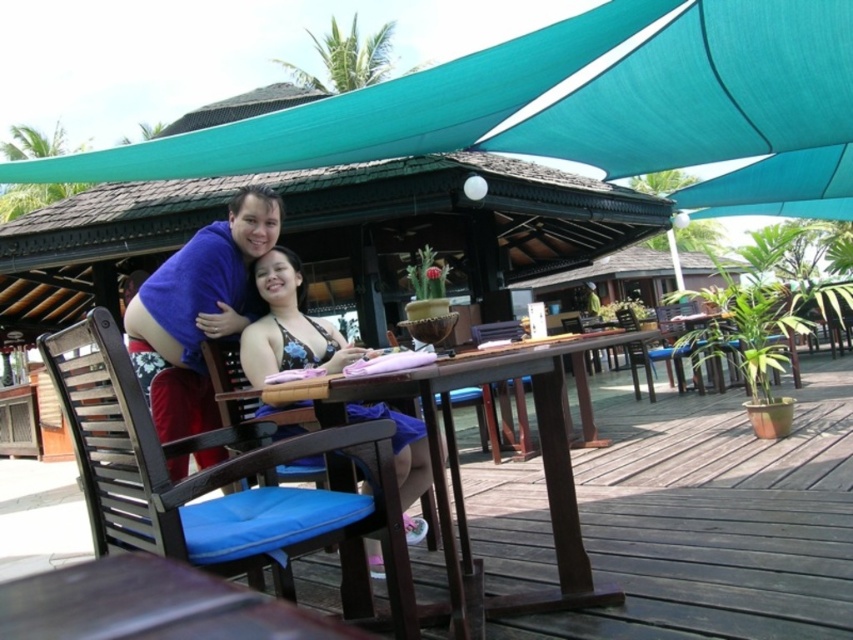
Question: Where is teal fabric canopy at upper center located in relation to blue padded chair at center in the image?

Choices:
 (A) left
 (B) right

Answer: (B)

Question: Where is teal fabric canopy at upper center located in relation to black floral bikini at center in the image?

Choices:
 (A) right
 (B) left

Answer: (A)

Question: Which of the following is the closest to the observer?

Choices:
 (A) blue padded chair at center
 (B) teal fabric canopy at upper center
 (C) brown wooden table at center
 (D) black floral bikini at center

Answer: (A)

Question: Which object is the farthest from the brown wooden table at center?

Choices:
 (A) blue padded chair at center
 (B) teal fabric canopy at upper center

Answer: (B)

Question: Which object appears closest to the camera in this image?

Choices:
 (A) brown wooden table at center
 (B) teal fabric canopy at upper center
 (C) black floral bikini at center
 (D) blue padded chair at center

Answer: (D)

Question: Does teal fabric canopy at upper center have a lesser width compared to black floral bikini at center?

Choices:
 (A) yes
 (B) no

Answer: (B)